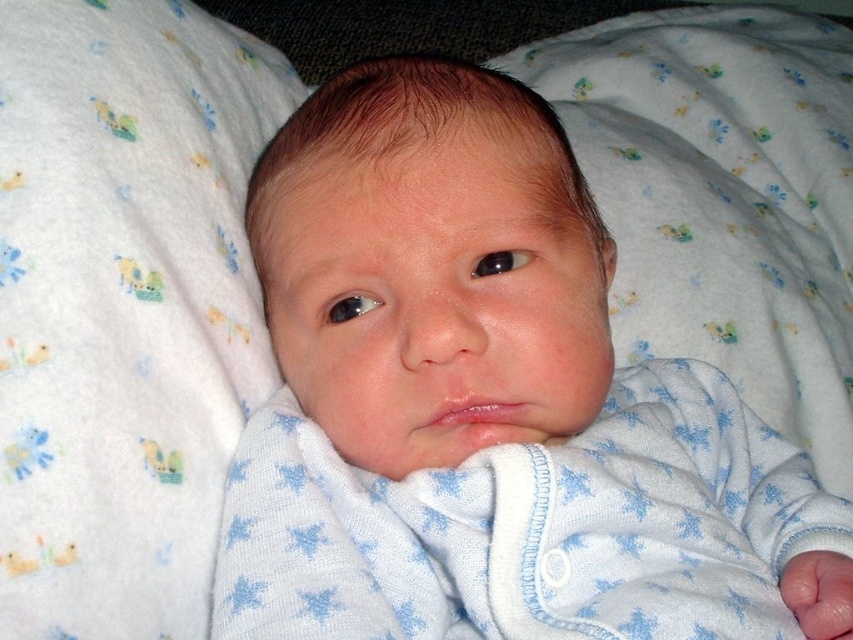
Is white soft fabric at center positioned before white knit fabric at center?

Yes, it is.

Who is lower down, white soft fabric at center or white knit fabric at center?

Positioned lower is white soft fabric at center.

This screenshot has height=640, width=853. I want to click on white soft fabric at center, so click(125, 307).

Is white soft fabric baby at center taller than white knit fabric at center?

No.

Between point (254, 566) and point (769, 120), which one is positioned behind?

The point (769, 120) is more distant.

The width and height of the screenshot is (853, 640). What are the coordinates of `white soft fabric baby at center` in the screenshot? It's located at (489, 404).

Can you confirm if white soft fabric baby at center is wider than white soft fabric at center?

Indeed, white soft fabric baby at center has a greater width compared to white soft fabric at center.

Is white soft fabric baby at center bigger than white soft fabric at center?

Yes.

Who is more distant from viewer, [325,436] or [235,285]?

The point [235,285] is more distant.

This screenshot has height=640, width=853. In order to click on white soft fabric baby at center in this screenshot , I will do `click(489, 404)`.